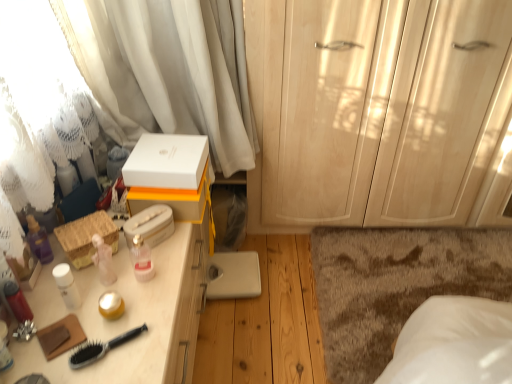
Question: Considering the relative positions of matte white lotion at left, which is the second toiletry from top to bottom, and woven straw basket at left, arranged as the first storage box when ordered from the bottom, in the image provided, is matte white lotion at left, which is the second toiletry from top to bottom, to the left or to the right of woven straw basket at left, arranged as the first storage box when ordered from the bottom,?

Choices:
 (A) left
 (B) right

Answer: (A)

Question: Is matte white lotion at left, which is the first toiletry in bottom-to-top order, wider or thinner than woven straw basket at left, the 3th storage box viewed from the top?

Choices:
 (A) wide
 (B) thin

Answer: (B)

Question: Which object is positioned farthest from the pink glossy bottle at center, which is counted as the 2th toiletry, starting from the front?

Choices:
 (A) black plastic brush at lower left
 (B) matte wood cabinet at right
 (C) matte white lotion at left, acting as the 2th toiletry starting from the right
 (D) white matte box at center, the first storage box from the top
 (E) white matte tissue box at upper center, positioned as the 2th storage box in top-to-bottom order

Answer: (B)

Question: Which of these objects is positioned farthest from the white matte tissue box at upper center, arranged as the second storage box when ordered from the bottom?

Choices:
 (A) white matte box at center, which appears as the third storage box when ordered from the bottom
 (B) brown shaggy rug at lower right
 (C) white sheer curtain at upper left
 (D) matte wood cabinet at right
 (E) black plastic brush at lower left

Answer: (B)